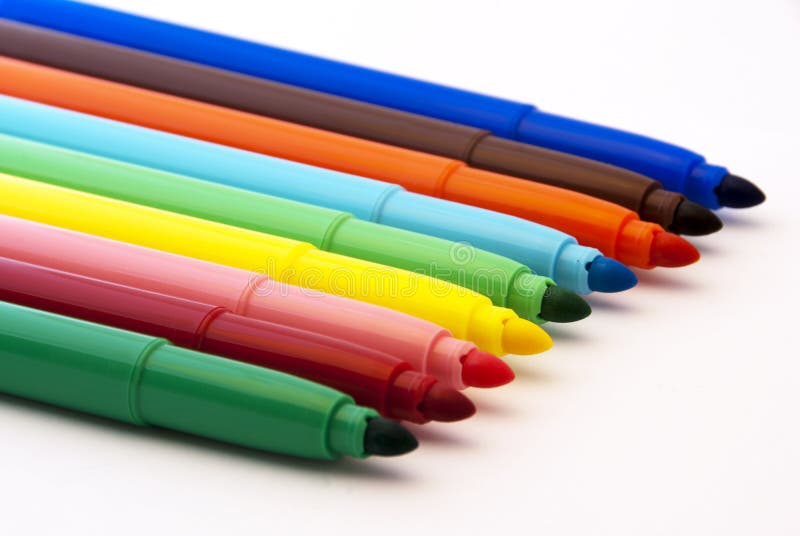
The height and width of the screenshot is (536, 800). Find the location of `marker felt tips`. marker felt tips is located at coordinates pyautogui.click(x=398, y=438), pyautogui.click(x=453, y=404), pyautogui.click(x=485, y=371), pyautogui.click(x=529, y=338), pyautogui.click(x=562, y=311), pyautogui.click(x=613, y=269), pyautogui.click(x=680, y=245), pyautogui.click(x=698, y=217), pyautogui.click(x=740, y=183).